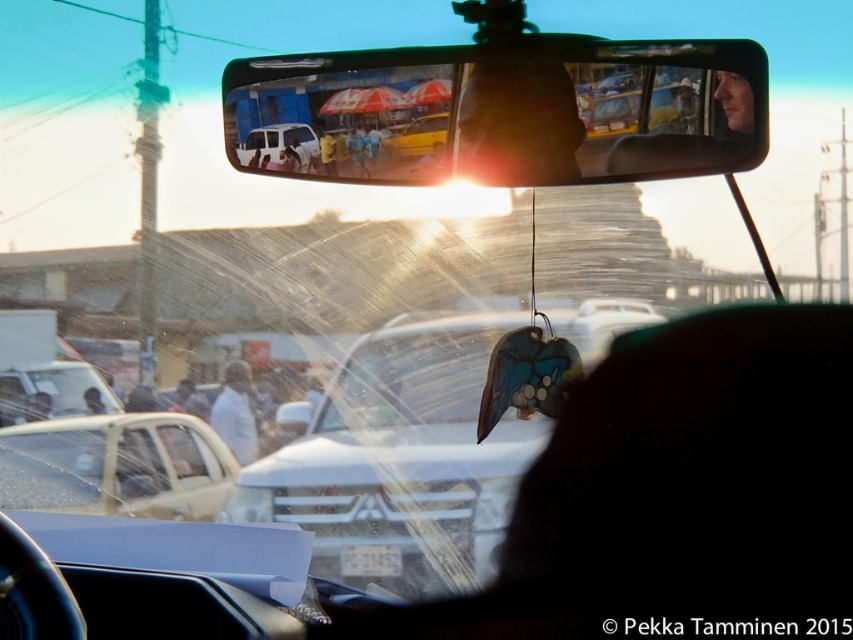
Between point (421, 88) and point (403, 540), which one is positioned behind?

Point (421, 88)

Can you confirm if clear plastic mirror at upper center is thinner than white glossy car at center?

No, clear plastic mirror at upper center is not thinner than white glossy car at center.

Who is more forward, (585, 65) or (593, 323)?

Point (593, 323)

Locate an element on the screen. The width and height of the screenshot is (853, 640). clear plastic mirror at upper center is located at coordinates (514, 109).

Between white matte truck at left and white matte shirt at center, which one has less height?

white matte truck at left

Is white matte truck at left wider than white matte shirt at center?

Yes.

Which is in front, point (19, 384) or point (235, 442)?

Point (235, 442)

Where is `white matte truck at left`? The width and height of the screenshot is (853, 640). white matte truck at left is located at coordinates (53, 388).

Who is lower down, white glossy car at center or white matte truck at left?

white glossy car at center is below.

Is white glossy car at center positioned at the back of white matte truck at left?

No.

Between point (339, 496) and point (50, 369), which one is positioned in front?

Point (339, 496)

Where is `white glossy car at center`? Image resolution: width=853 pixels, height=640 pixels. white glossy car at center is located at coordinates (401, 456).